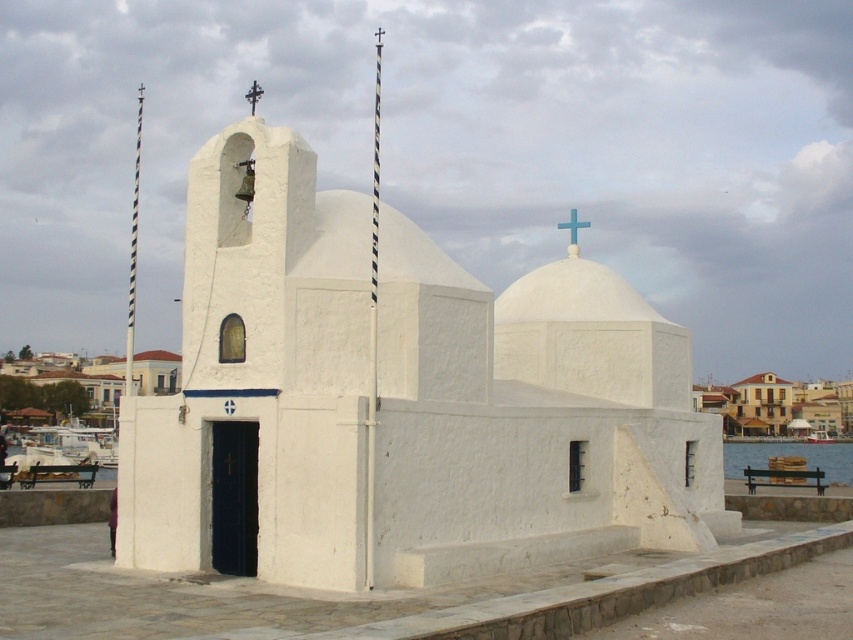
Question: Does white matte chapel at center come behind metallic cross at upper center?

Choices:
 (A) yes
 (B) no

Answer: (B)

Question: Which is farther from the white matte chapel at center?

Choices:
 (A) blue plastic cross at upper center
 (B) metallic cross at upper center
 (C) blue water at lower right

Answer: (C)

Question: Can you confirm if black and white striped pole at left is bigger than blue plastic cross at upper center?

Choices:
 (A) yes
 (B) no

Answer: (A)

Question: Which point appears closest to the camera in this image?

Choices:
 (A) (573, 227)
 (B) (764, 467)
 (C) (252, 102)

Answer: (C)

Question: Is white matte chapel at center thinner than black and white striped pole at left?

Choices:
 (A) no
 (B) yes

Answer: (A)

Question: Based on their relative distances, which object is nearer to the blue water at lower right?

Choices:
 (A) metallic cross at upper center
 (B) white matte chapel at center
 (C) blue plastic cross at upper center

Answer: (B)